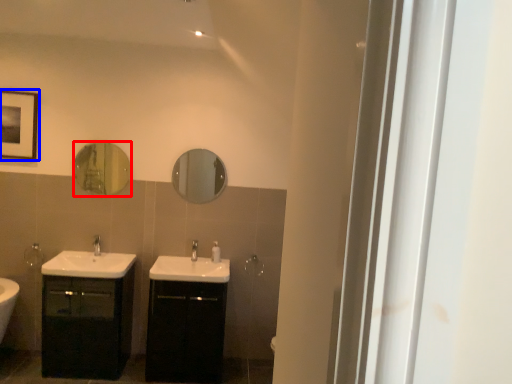
Question: Which point is closer to the camera, mirror (highlighted by a red box) or picture frame (highlighted by a blue box)?

Choices:
 (A) mirror
 (B) picture frame

Answer: (B)